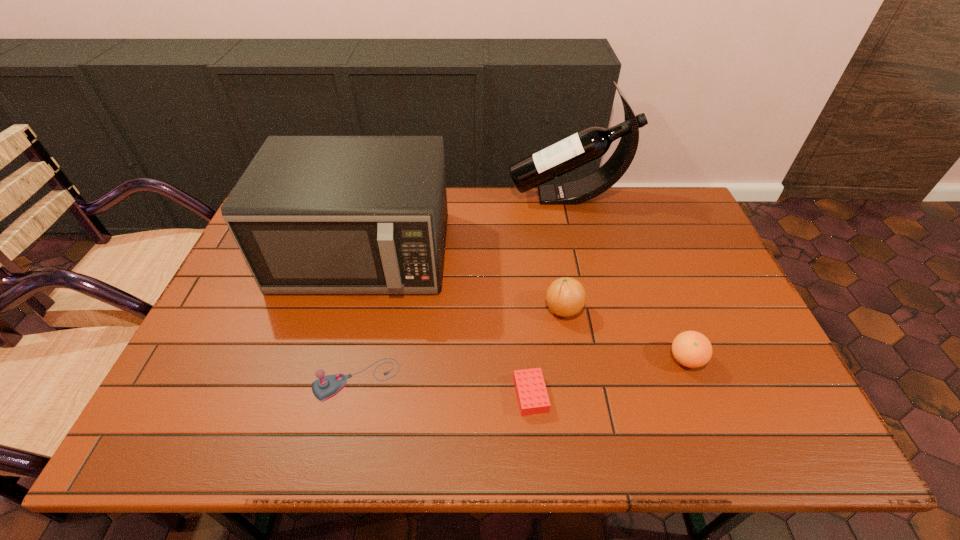
Find the location of a particular element. free space located 0.160m on the stand of the tallest object is located at coordinates (463, 197).

Locate an element on the screen. free region located 0.280m on the stand of the tallest object is located at coordinates (428, 197).

Identify the location of free space located on the front-facing side of the microwave oven. The height and width of the screenshot is (540, 960). (326, 387).

Identify the location of vacant space located on the front of the left orange. This screenshot has height=540, width=960. (571, 353).

Identify the location of free space located 0.320m on the back of the shorter orange. The width and height of the screenshot is (960, 540). (647, 258).

You are a GUI agent. You are given a task and a screenshot of the screen. Output one action in this format:
    pyautogui.click(x=<x>, y=<y>)
    Task: Click on the vacant area situated 0.190m on the back of the joystick
    
    Given the screenshot: What is the action you would take?
    pyautogui.click(x=374, y=300)

Locate an element on the screen. The width and height of the screenshot is (960, 540). vacant space located on the right of the Lego is located at coordinates (703, 395).

Image resolution: width=960 pixels, height=540 pixels. I want to click on wine bottle that is at the far edge, so click(x=579, y=149).

This screenshot has width=960, height=540. Identify the location of microwave oven at the far edge. (311, 214).

Where is `object that is at the near edge`? This screenshot has height=540, width=960. object that is at the near edge is located at coordinates (532, 396).